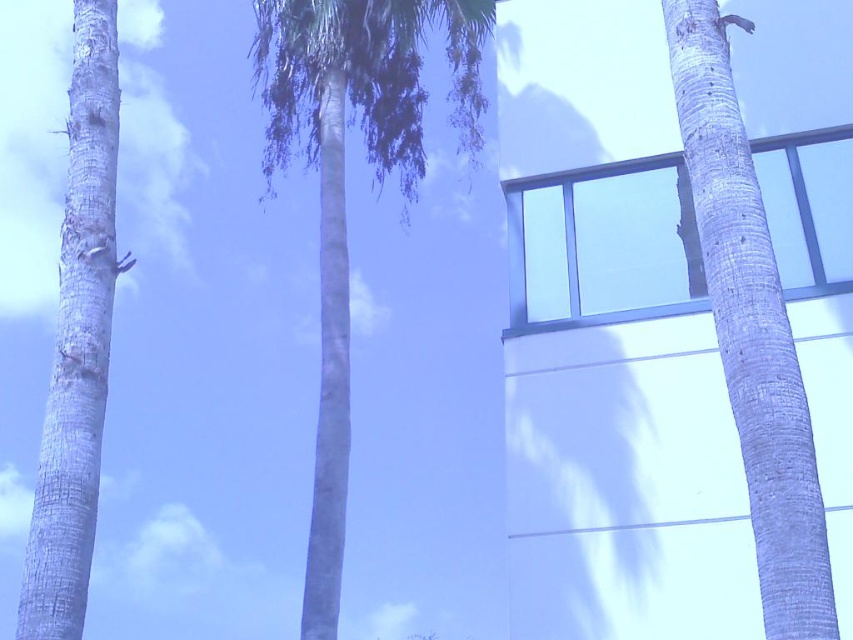
You are standing in front of the modern architectural structure described. There is a smooth gray palm tree at center at point (343, 184). Can you confirm if this point is located on the palm tree?

Yes, the point (343, 184) is located on the smooth gray palm tree at center as stated in the objects description.

From the picture: You are standing in front of the building and notice two smooth gray bark trees. Which one is nearer to you, the smooth gray bark at right or the smooth gray bark at left?

The smooth gray bark at right is closer to the viewer than the smooth gray bark at left.